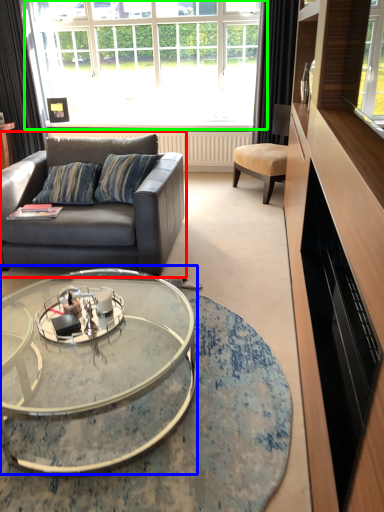
Question: Considering the real-world distances, which object is closest to studio couch (highlighted by a red box)? coffee table (highlighted by a blue box) or window (highlighted by a green box).

Choices:
 (A) coffee table
 (B) window

Answer: (A)